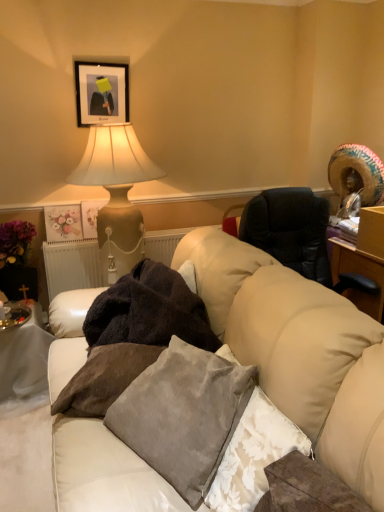
Question: Based on their positions, is velvet gray pillow at center, the 1th pillow from the right, located to the left or right of velvet gray pillow at center, which appears as the first pillow when viewed from the left?

Choices:
 (A) right
 (B) left

Answer: (A)

Question: In terms of width, does velvet gray pillow at center, the 1th pillow from the right, look wider or thinner when compared to velvet gray pillow at center, which appears as the third pillow when viewed from the right?

Choices:
 (A) wide
 (B) thin

Answer: (B)

Question: Which of these objects is positioned closest to the white fabric table at lower left?

Choices:
 (A) velvet gray pillow at center, the 1th pillow from the right
 (B) matte floral print at upper left
 (C) velvet gray pillow at center, which appears as the 2th pillow when viewed from the left
 (D) matte black picture frame at upper left
 (E) matte beige lamp at upper left

Answer: (B)

Question: Which is farther from the matte floral print at upper left?

Choices:
 (A) matte beige lamp at upper left
 (B) matte black picture frame at upper left
 (C) white leather couch at center
 (D) multicolored woven straw hat at upper right
 (E) velvet gray pillow at center, marked as the 3th pillow in a left-to-right arrangement

Answer: (E)